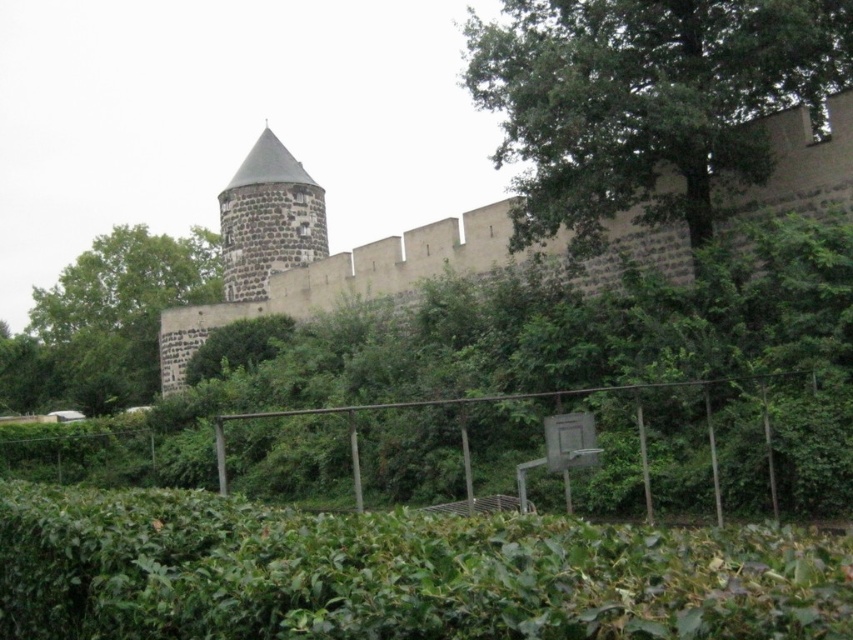
Is green leafy tree at upper right bigger than brown stone wall at upper center?

Indeed, green leafy tree at upper right has a larger size compared to brown stone wall at upper center.

Does point (631, 40) come closer to viewer compared to point (308, 316)?

Yes, point (631, 40) is in front of point (308, 316).

Who is more distant from viewer, (523, 221) or (415, 237)?

The point (415, 237) is more distant.

Locate an element on the screen. The image size is (853, 640). green leafy tree at upper right is located at coordinates (646, 100).

Is green leafy tree at upper right wider than stone gray tower at center?

Correct, the width of green leafy tree at upper right exceeds that of stone gray tower at center.

What do you see at coordinates (646, 100) in the screenshot? I see `green leafy tree at upper right` at bounding box center [646, 100].

Where is `green leafy tree at upper right`? The height and width of the screenshot is (640, 853). green leafy tree at upper right is located at coordinates (646, 100).

This screenshot has height=640, width=853. Identify the location of green leafy tree at upper right. (646, 100).

Who is shorter, green leafy hedge at lower center or brown stone wall at upper center?

With less height is green leafy hedge at lower center.

Does green leafy hedge at lower center come in front of brown stone wall at upper center?

Yes.

The image size is (853, 640). Find the location of `green leafy hedge at lower center`. green leafy hedge at lower center is located at coordinates point(395,573).